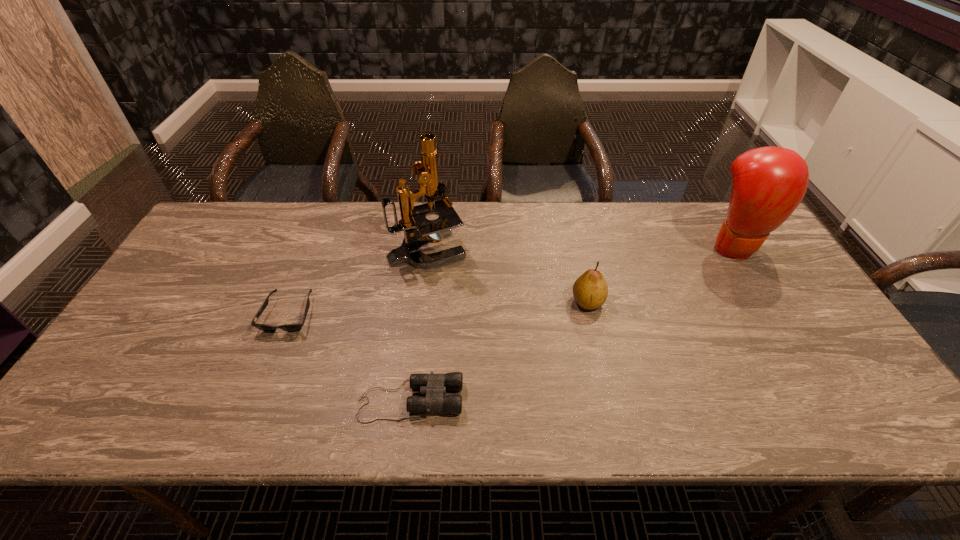
This screenshot has height=540, width=960. In order to click on free space located 0.160m at the eyepiece of the binoculars in this screenshot , I will do `click(534, 401)`.

You are a GUI agent. You are given a task and a screenshot of the screen. Output one action in this format:
    pyautogui.click(x=<x>, y=<y>)
    Task: Click on the free space located 0.240m on the front-facing side of the sunglasses
    The width and height of the screenshot is (960, 540).
    Given the screenshot: What is the action you would take?
    pyautogui.click(x=245, y=425)

The width and height of the screenshot is (960, 540). What are the coordinates of `microscope that is at the far edge` in the screenshot? It's located at (413, 217).

Where is `boxing glove at the far edge`? boxing glove at the far edge is located at coordinates (769, 183).

The height and width of the screenshot is (540, 960). Identify the location of object that is positioned at the near edge. (434, 386).

I want to click on object that is at the right edge, so click(x=769, y=183).

This screenshot has height=540, width=960. Find the location of `object present at the far right corner`. object present at the far right corner is located at coordinates (769, 183).

In the image, there is a desktop. Identify the location of vacant region at the far edge. click(587, 241).

The width and height of the screenshot is (960, 540). In the image, there is a desktop. In order to click on free region at the near edge in this screenshot , I will do `click(381, 404)`.

Locate an element on the screen. This screenshot has height=540, width=960. vacant area at the left edge is located at coordinates (122, 377).